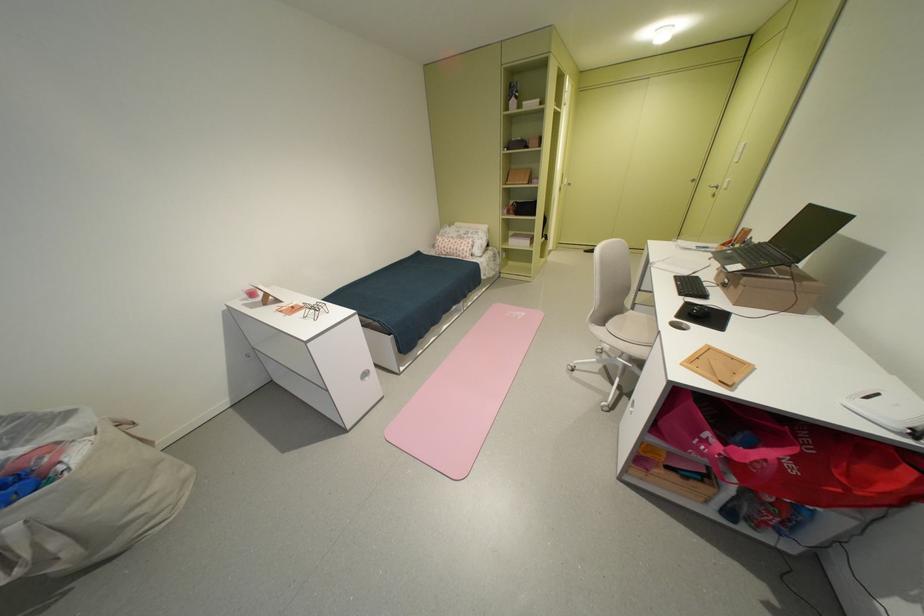
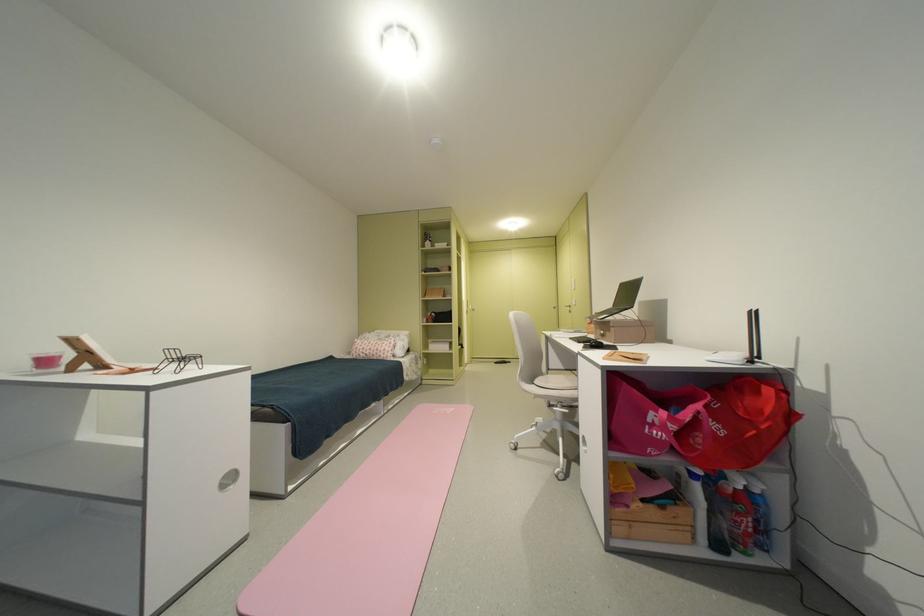
In the second image, find the point that corresponds to the point at 849,492 in the first image.

(764, 434)